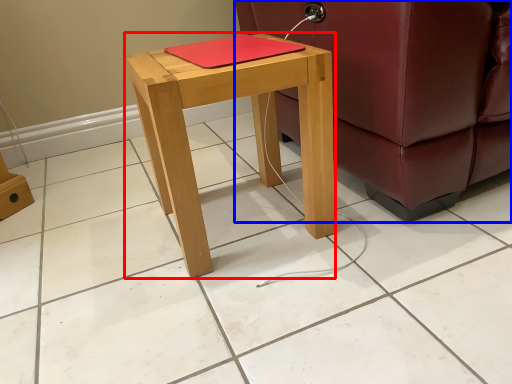
Question: Which point is closer to the camera, stool (highlighted by a red box) or studio couch (highlighted by a blue box)?

Choices:
 (A) stool
 (B) studio couch

Answer: (B)